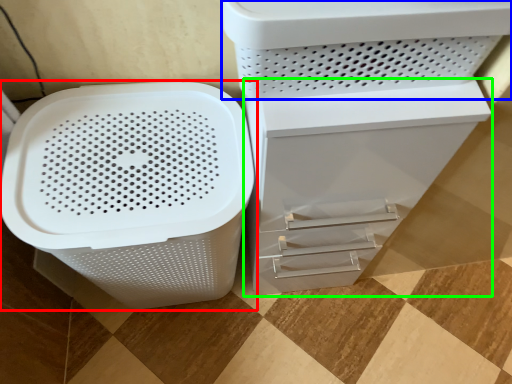
Question: Considering the real-world distances, which object is closest to waste container (highlighted by a red box)? appliance (highlighted by a blue box) or file cabinet (highlighted by a green box).

Choices:
 (A) appliance
 (B) file cabinet

Answer: (B)